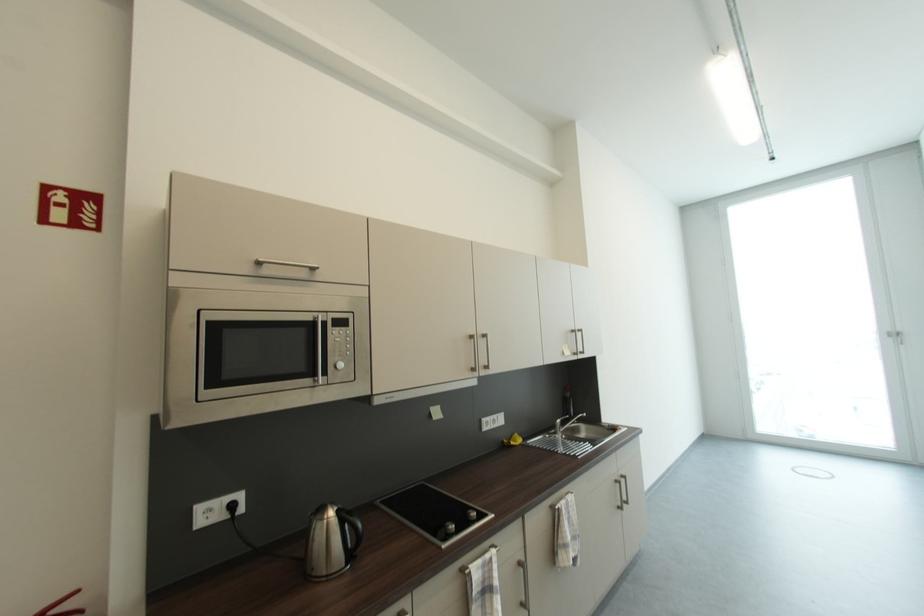
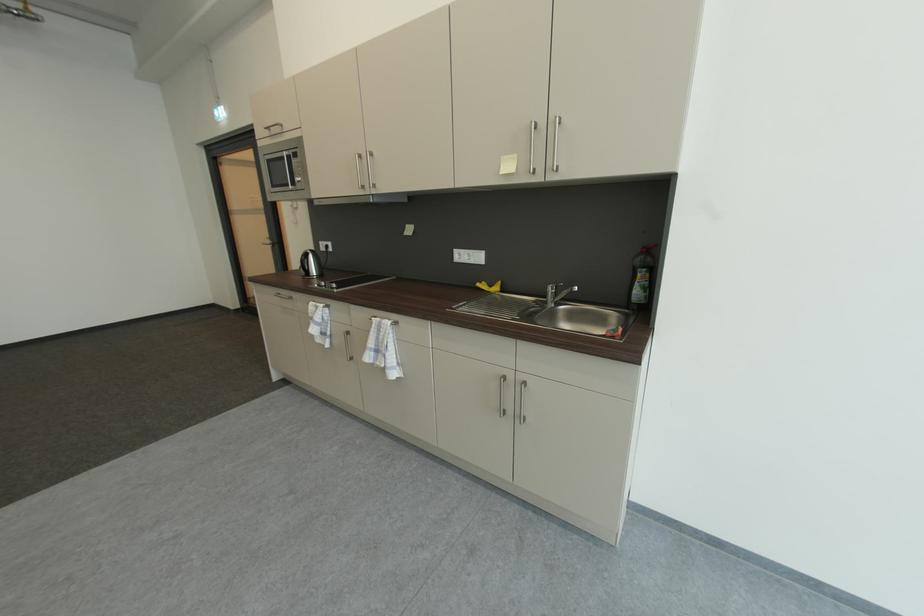
The point at (503, 427) is marked in the first image. Where is the corresponding point in the second image?

(479, 262)